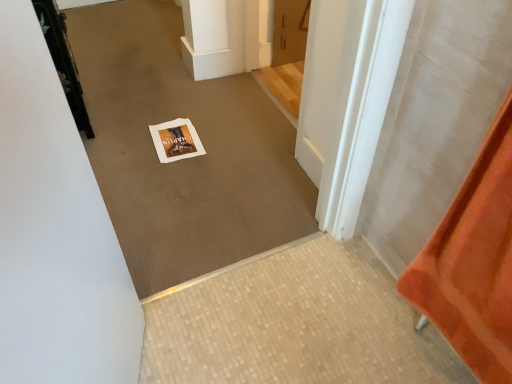
Question: Does matte wood door at upper center, the second door viewed from the left, have a larger size compared to white paper at center?

Choices:
 (A) yes
 (B) no

Answer: (B)

Question: Is matte wood door at upper center, placed as the first door when sorted from right to left, thinner than white paper at center?

Choices:
 (A) no
 (B) yes

Answer: (B)

Question: From the image's perspective, is matte wood door at upper center, the second door viewed from the left, under white paper at center?

Choices:
 (A) no
 (B) yes

Answer: (A)

Question: Is matte wood door at upper center, the second door viewed from the left, to the right of white paper at center from the viewer's perspective?

Choices:
 (A) yes
 (B) no

Answer: (A)

Question: Does matte wood door at upper center, placed as the first door when sorted from right to left, touch white paper at center?

Choices:
 (A) yes
 (B) no

Answer: (B)

Question: Is white paper at center situated inside black metal door at upper left, the first door in the left-to-right sequence, or outside?

Choices:
 (A) inside
 (B) outside

Answer: (B)

Question: Considering the positions of point (206, 243) and point (70, 104), is point (206, 243) closer or farther from the camera than point (70, 104)?

Choices:
 (A) farther
 (B) closer

Answer: (B)

Question: In terms of width, does white paper at center look wider or thinner when compared to black metal door at upper left, the first door in the left-to-right sequence?

Choices:
 (A) wide
 (B) thin

Answer: (A)

Question: Relative to black metal door at upper left, which is the 2th door in right-to-left order, is white paper at center in front or behind?

Choices:
 (A) front
 (B) behind

Answer: (A)

Question: Is white paper at center situated inside matte wood door at upper center, placed as the first door when sorted from right to left, or outside?

Choices:
 (A) inside
 (B) outside

Answer: (B)

Question: From the image's perspective, is white paper at center positioned above or below matte wood door at upper center, the second door viewed from the left?

Choices:
 (A) below
 (B) above

Answer: (A)

Question: Looking at their shapes, would you say white paper at center is wider or thinner than matte wood door at upper center, placed as the first door when sorted from right to left?

Choices:
 (A) wide
 (B) thin

Answer: (A)

Question: Looking at the image, does white paper at center seem bigger or smaller compared to matte wood door at upper center, the second door viewed from the left?

Choices:
 (A) small
 (B) big

Answer: (B)

Question: In the image, is white paper at center positioned in front of or behind white paper at center?

Choices:
 (A) behind
 (B) front

Answer: (B)

Question: In terms of width, does white paper at center look wider or thinner when compared to white paper at center?

Choices:
 (A) wide
 (B) thin

Answer: (B)